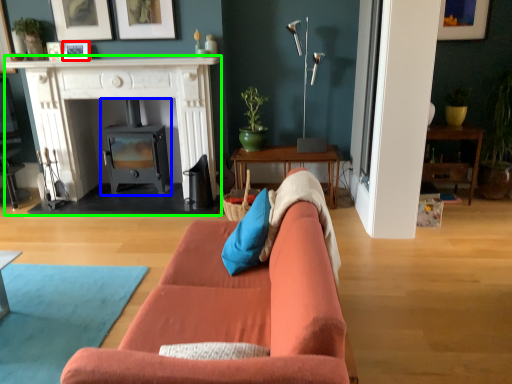
Question: Which object is positioned farthest from picture frame (highlighted by a red box)? Select from wood burning stove (highlighted by a blue box) and fireplace (highlighted by a green box).

Choices:
 (A) wood burning stove
 (B) fireplace

Answer: (A)